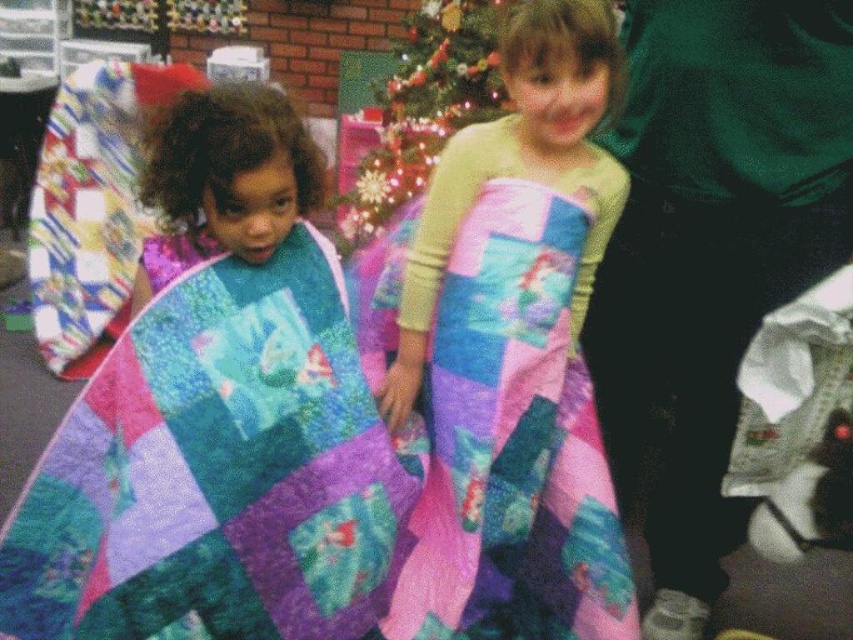
Question: Among these points, which one is farthest from the camera?

Choices:
 (A) (279, 148)
 (B) (297, 403)
 (C) (433, 465)

Answer: (C)

Question: Which of the following is the farthest from the observer?

Choices:
 (A) shiny green christmas tree at upper center
 (B) multicolored fleece blanket at center

Answer: (A)

Question: In this image, where is multicolored quilt at left located relative to shiny green christmas tree at upper center?

Choices:
 (A) right
 (B) left

Answer: (B)

Question: Which of the following is the farthest from the observer?

Choices:
 (A) multicolored fleece blanket at center
 (B) multicolored quilted blanket at left

Answer: (A)

Question: Is multicolored quilt at left wider than multicolored fleece blanket at center?

Choices:
 (A) yes
 (B) no

Answer: (A)

Question: Is multicolored quilt at left to the left of multicolored fleece blanket at center from the viewer's perspective?

Choices:
 (A) no
 (B) yes

Answer: (B)